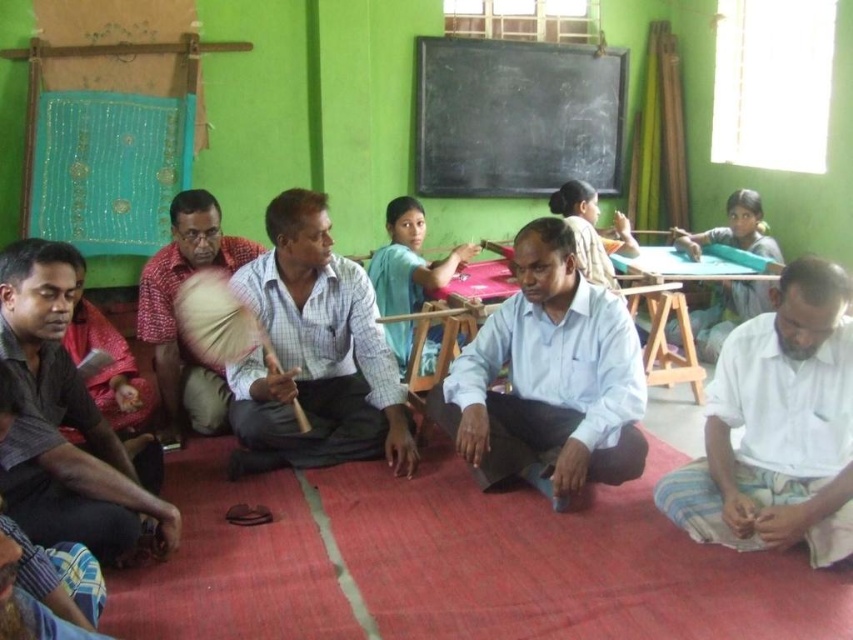
Question: Observing the image, what is the correct spatial positioning of reddish-brown fabric at center in reference to light blue fabric at center?

Choices:
 (A) right
 (B) left

Answer: (B)

Question: Does white cotton shirt at lower right have a greater width compared to dark gray shirt at left?

Choices:
 (A) yes
 (B) no

Answer: (A)

Question: Can you confirm if dark gray shirt at left is thinner than reddish-brown fabric at center?

Choices:
 (A) no
 (B) yes

Answer: (B)

Question: Which of the following is the closest to the observer?

Choices:
 (A) light blue fabric at center
 (B) dark gray shirt at left
 (C) light blue shirt at center

Answer: (B)

Question: Which of the following is the closest to the observer?

Choices:
 (A) (404, 365)
 (B) (728, 396)
 (C) (349, 388)
 (D) (503, 67)

Answer: (B)

Question: Which is farther from the reddish-brown fabric at center?

Choices:
 (A) matte green fabric at upper right
 (B) light blue fabric at center

Answer: (A)